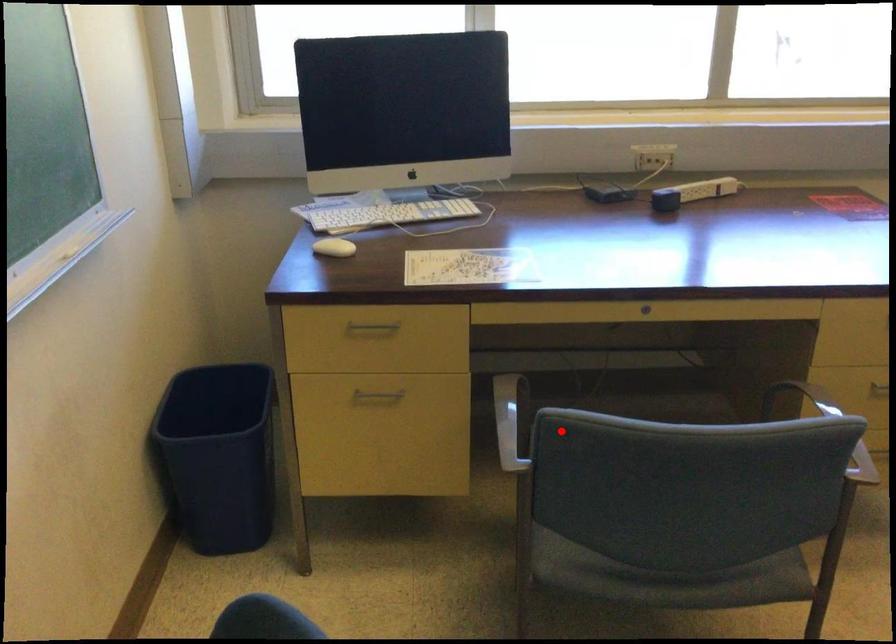
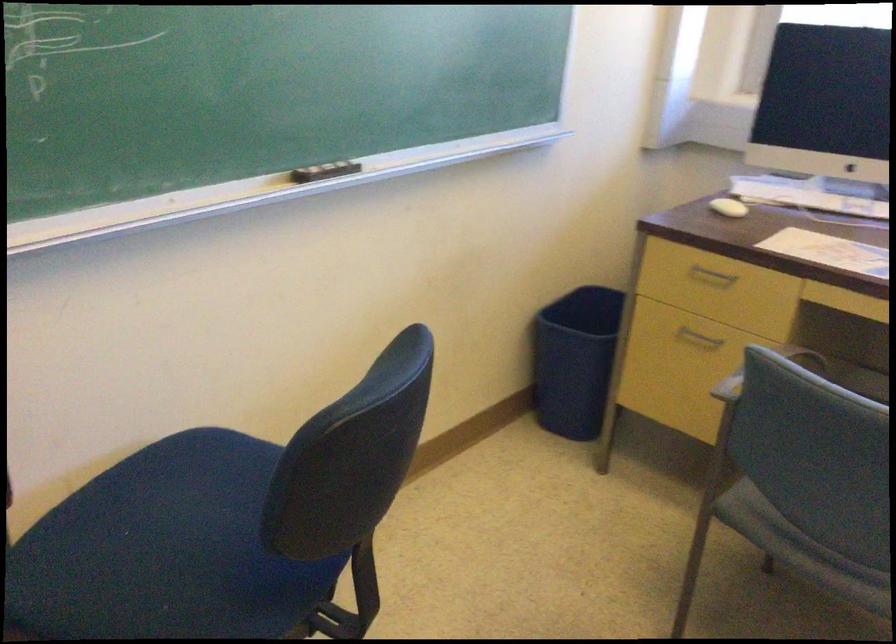
In the second image, find the point that corresponds to the highlighted location in the first image.

(764, 371)